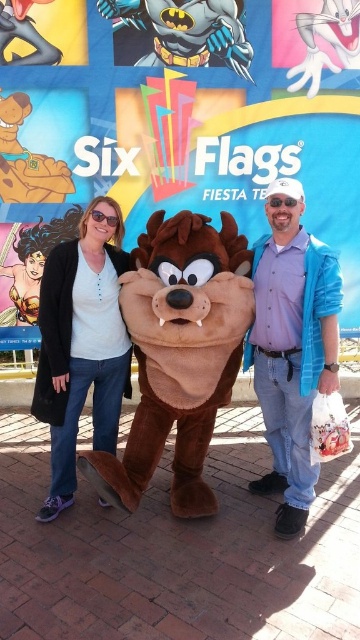
Can you confirm if brown plush at center is positioned above blue denim jeans at center?

Incorrect, brown plush at center is not positioned above blue denim jeans at center.

Is point (192, 435) more distant than point (295, 196)?

Yes, point (192, 435) is farther from viewer.

Where is `brown plush at center`? This screenshot has height=640, width=360. brown plush at center is located at coordinates (180, 356).

Is brown plush at center bigger than matte black sweater at left?

Indeed, brown plush at center has a larger size compared to matte black sweater at left.

This screenshot has width=360, height=640. What are the coordinates of `brown plush at center` in the screenshot? It's located at (180, 356).

The width and height of the screenshot is (360, 640). What do you see at coordinates (180, 356) in the screenshot? I see `brown plush at center` at bounding box center [180, 356].

What are the coordinates of `brown plush at center` in the screenshot? It's located at (180, 356).

Can you confirm if blue denim jeans at center is positioned above matte black sweater at left?

Correct, blue denim jeans at center is located above matte black sweater at left.

Can you confirm if blue denim jeans at center is wider than matte black sweater at left?

No, blue denim jeans at center is not wider than matte black sweater at left.

Who is more forward, (x=280, y=516) or (x=52, y=262)?

Positioned in front is point (x=280, y=516).

This screenshot has height=640, width=360. What are the coordinates of `blue denim jeans at center` in the screenshot? It's located at (291, 346).